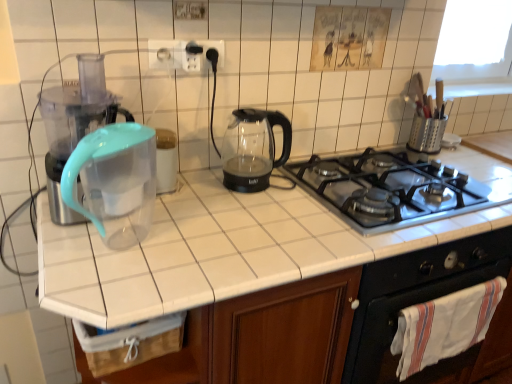
Question: From a real-world perspective, does metallic gray gas stove at center sit lower than white plastic electric outlet at upper center, which ranks as the second electric outlet in left-to-right order?

Choices:
 (A) no
 (B) yes

Answer: (B)

Question: Could you tell me if metallic gray gas stove at center is facing white plastic electric outlet at upper center, which ranks as the second electric outlet in left-to-right order?

Choices:
 (A) yes
 (B) no

Answer: (B)

Question: Can white plastic electric outlet at upper center, placed as the first electric outlet when sorted from right to left, be found inside metallic gray gas stove at center?

Choices:
 (A) no
 (B) yes

Answer: (A)

Question: Are metallic gray gas stove at center and white plastic electric outlet at upper center, which ranks as the second electric outlet in left-to-right order, far apart?

Choices:
 (A) yes
 (B) no

Answer: (B)

Question: Is metallic gray gas stove at center thinner than white plastic electric outlet at upper center, placed as the first electric outlet when sorted from right to left?

Choices:
 (A) yes
 (B) no

Answer: (B)

Question: Do you think white cotton towel at lower right is within white plastic electric outlet at upper center, placed as the first electric outlet when sorted from right to left, or outside of it?

Choices:
 (A) outside
 (B) inside

Answer: (A)

Question: Is white cotton towel at lower right wider or thinner than white plastic electric outlet at upper center, which ranks as the second electric outlet in left-to-right order?

Choices:
 (A) thin
 (B) wide

Answer: (B)

Question: From the image's perspective, is white cotton towel at lower right above or below white plastic electric outlet at upper center, placed as the first electric outlet when sorted from right to left?

Choices:
 (A) above
 (B) below

Answer: (B)

Question: From a real-world perspective, is white cotton towel at lower right above or below white plastic electric outlet at upper center, placed as the first electric outlet when sorted from right to left?

Choices:
 (A) below
 (B) above

Answer: (A)

Question: Is black matte oven at lower right in front of or behind transparent plastic water filter pitcher at left in the image?

Choices:
 (A) front
 (B) behind

Answer: (B)

Question: Is point (408, 264) closer or farther from the camera than point (95, 175)?

Choices:
 (A) farther
 (B) closer

Answer: (A)

Question: From a real-world perspective, is black matte oven at lower right positioned above or below transparent plastic water filter pitcher at left?

Choices:
 (A) below
 (B) above

Answer: (A)

Question: Would you say black matte oven at lower right is inside or outside transparent plastic water filter pitcher at left?

Choices:
 (A) inside
 (B) outside

Answer: (B)

Question: Relative to transparent plastic water filter pitcher at left, is metallic gray gas stove at center in front or behind?

Choices:
 (A) front
 (B) behind

Answer: (B)

Question: Is metallic gray gas stove at center wider or thinner than transparent plastic water filter pitcher at left?

Choices:
 (A) thin
 (B) wide

Answer: (B)